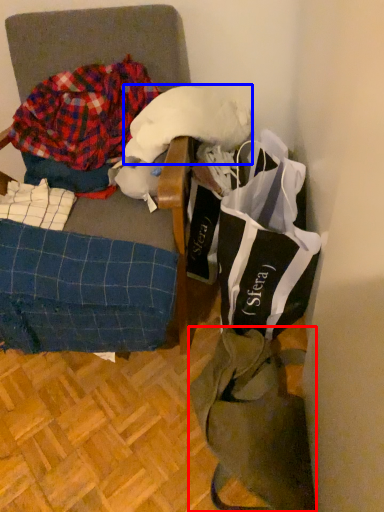
Question: Among these objects, which one is farthest to the camera, tote bag (highlighted by a red box) or wool (highlighted by a blue box)?

Choices:
 (A) tote bag
 (B) wool

Answer: (B)